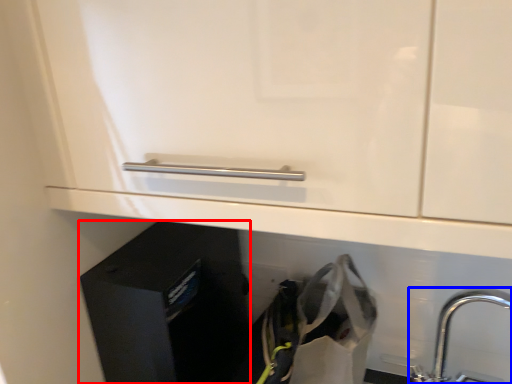
Question: Which of the following is the farthest to the observer, file cabinet (highlighted by a red box) or tap (highlighted by a blue box)?

Choices:
 (A) file cabinet
 (B) tap

Answer: (A)